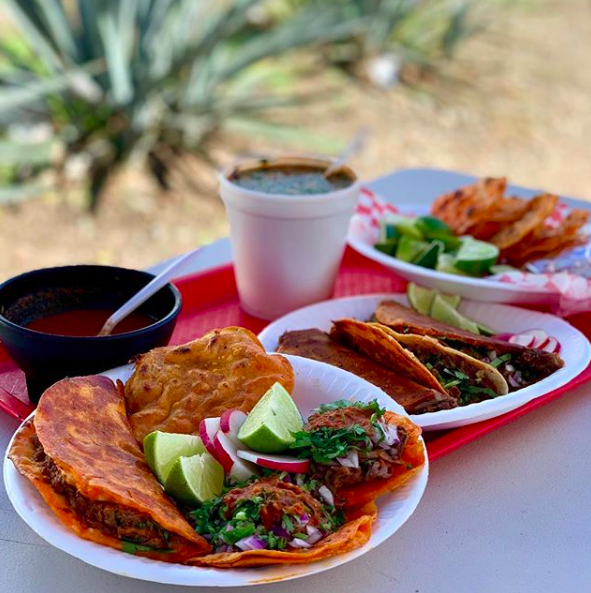
This screenshot has width=591, height=593. I want to click on cup, so click(293, 245).